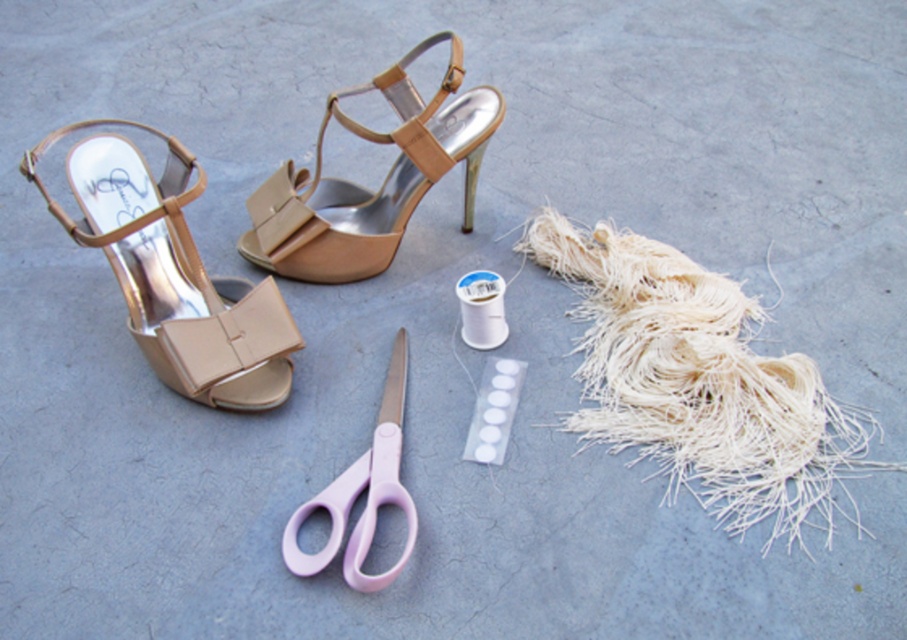
Can you confirm if matte beige sandal at left is positioned to the left of pink plastic scissors at center?

Correct, you'll find matte beige sandal at left to the left of pink plastic scissors at center.

Can you confirm if matte beige sandal at left is shorter than pink plastic scissors at center?

No, matte beige sandal at left is not shorter than pink plastic scissors at center.

Is point (219, 385) more distant than point (330, 534)?

That is True.

What are the coordinates of `matte beige sandal at left` in the screenshot? It's located at (173, 273).

Which is above, white frayed yarn at lower right or matte beige sandal at center?

matte beige sandal at center is higher up.

Between white frayed yarn at lower right and matte beige sandal at center, which one has less height?

With less height is matte beige sandal at center.

Where is `white frayed yarn at lower right`? Image resolution: width=907 pixels, height=640 pixels. white frayed yarn at lower right is located at coordinates (698, 381).

Image resolution: width=907 pixels, height=640 pixels. I want to click on white frayed yarn at lower right, so click(698, 381).

Is point (654, 248) positioned behind point (397, 388)?

Yes.

Between point (590, 328) and point (387, 404), which one is positioned in front?

Positioned in front is point (387, 404).

Does point (632, 308) come in front of point (396, 464)?

No.

Where is `white frayed yarn at lower right`? white frayed yarn at lower right is located at coordinates (698, 381).